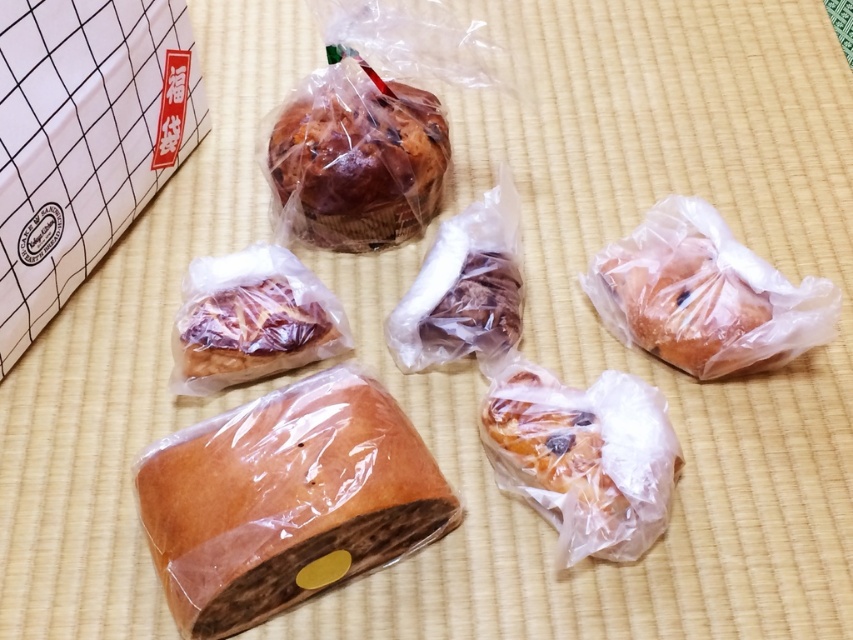
Question: Which object is positioned farthest from the brown glossy muffin at upper center?

Choices:
 (A) brown glossy bread at center
 (B) translucent plastic pastry at center
 (C) golden brown crusty loaf at center

Answer: (C)

Question: Among these points, which one is nearest to the camera?

Choices:
 (A) (527, 417)
 (B) (329, 406)

Answer: (B)

Question: Does golden brown doughnut at center have a greater width compared to translucent plastic pastry at center?

Choices:
 (A) yes
 (B) no

Answer: (A)

Question: Can you confirm if golden brown crusty loaf at center is positioned below golden brown bread at center?

Choices:
 (A) yes
 (B) no

Answer: (A)

Question: Considering the real-world distances, which object is farthest from the golden brown crusty loaf at center?

Choices:
 (A) brown glossy bread at center
 (B) translucent plastic pastry at center
 (C) brown glossy muffin at upper center
 (D) golden brown bread at center

Answer: (D)

Question: Can you confirm if golden brown crusty loaf at center is positioned below golden brown doughnut at center?

Choices:
 (A) yes
 (B) no

Answer: (A)